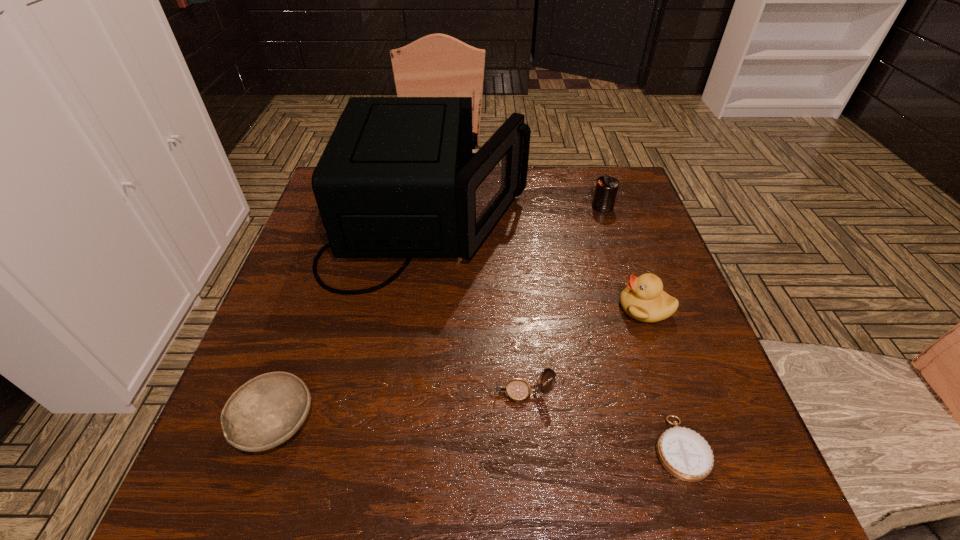
Image resolution: width=960 pixels, height=540 pixels. What are the coordinates of `bowl that is at the near edge` in the screenshot? It's located at (266, 411).

Locate an element on the screen. compass positioned at the near edge is located at coordinates pyautogui.click(x=685, y=454).

The image size is (960, 540). I want to click on microwave oven at the left edge, so click(398, 178).

This screenshot has width=960, height=540. I want to click on bowl that is at the left edge, so click(x=266, y=411).

Find the location of a particular element. This screenshot has height=540, width=960. can present at the right edge is located at coordinates (606, 189).

In order to click on duckling that is at the right edge in this screenshot , I will do `click(643, 299)`.

This screenshot has width=960, height=540. I want to click on compass present at the right edge, so click(685, 454).

This screenshot has width=960, height=540. What are the coordinates of `object at the far left corner` in the screenshot? It's located at (398, 178).

Where is `object that is at the near left corner`? The width and height of the screenshot is (960, 540). object that is at the near left corner is located at coordinates (266, 411).

I want to click on object present at the far right corner, so click(x=606, y=189).